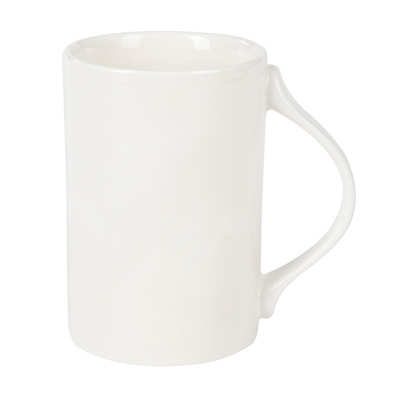
Locate an element on the screen. The height and width of the screenshot is (400, 400). 5 points spread around the inside of the mug is located at coordinates (96, 48), (152, 44), (227, 53), (192, 64), (132, 64).